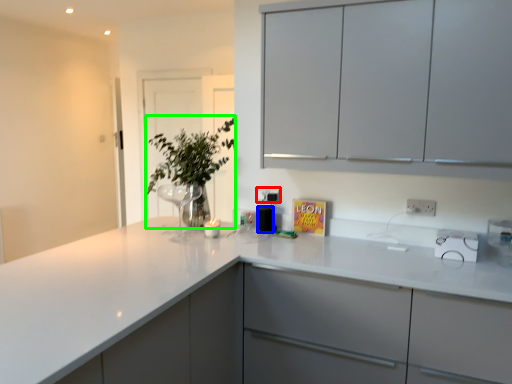
Question: Estimate the real-world distances between objects in this image. Which object is farther from electric outlet (highlighted by a red box), appliance (highlighted by a blue box) or plant (highlighted by a green box)?

Choices:
 (A) appliance
 (B) plant

Answer: (B)